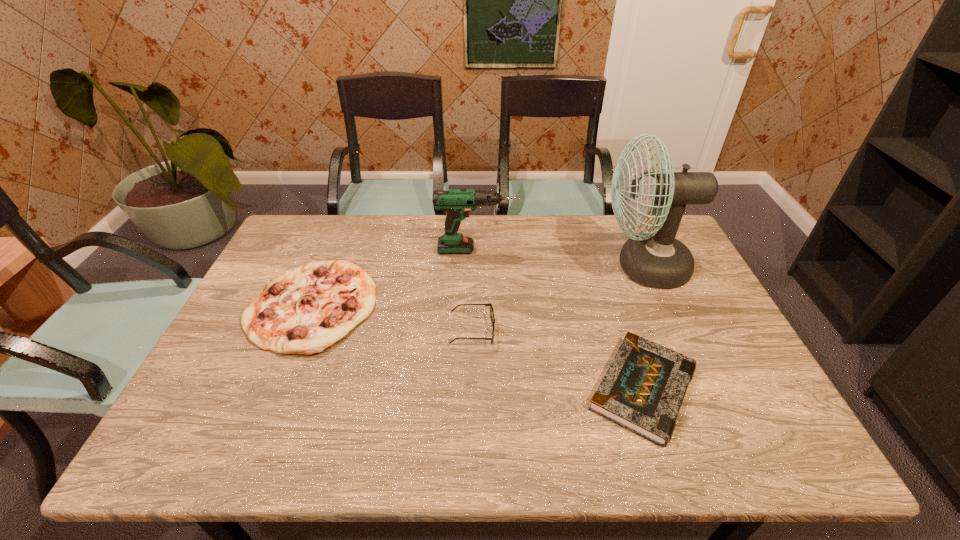
This screenshot has width=960, height=540. In the image, there is a desktop. In order to click on vacant space at the far edge in this screenshot , I will do `click(430, 240)`.

Image resolution: width=960 pixels, height=540 pixels. In the image, there is a desktop. Find the location of `vacant region at the near edge`. vacant region at the near edge is located at coordinates click(x=261, y=422).

Where is `vacant region at the left edge`? The image size is (960, 540). vacant region at the left edge is located at coordinates (247, 301).

You are a GUI agent. You are given a task and a screenshot of the screen. Output one action in this format:
    pyautogui.click(x=<x>, y=<y>)
    Task: Click on the free space at the right edge of the desktop
    The image size is (960, 540).
    Given the screenshot: What is the action you would take?
    pyautogui.click(x=678, y=313)

Locate an element on the screen. The width and height of the screenshot is (960, 540). unoccupied area between the spectacles and the notebook is located at coordinates (558, 360).

This screenshot has height=540, width=960. Identify the location of vacant space that's between the notebook and the leftmost object. (477, 348).

Locate an element on the screen. The image size is (960, 540). free space between the leftmost object and the spectacles is located at coordinates (392, 319).

The image size is (960, 540). I want to click on empty space between the notebook and the fourth shortest object, so click(560, 319).

Identify the location of empty space between the leftmost object and the spectacles. The image size is (960, 540). [392, 319].

Where is `free space between the spectacles and the fan`? Image resolution: width=960 pixels, height=540 pixels. free space between the spectacles and the fan is located at coordinates (558, 299).